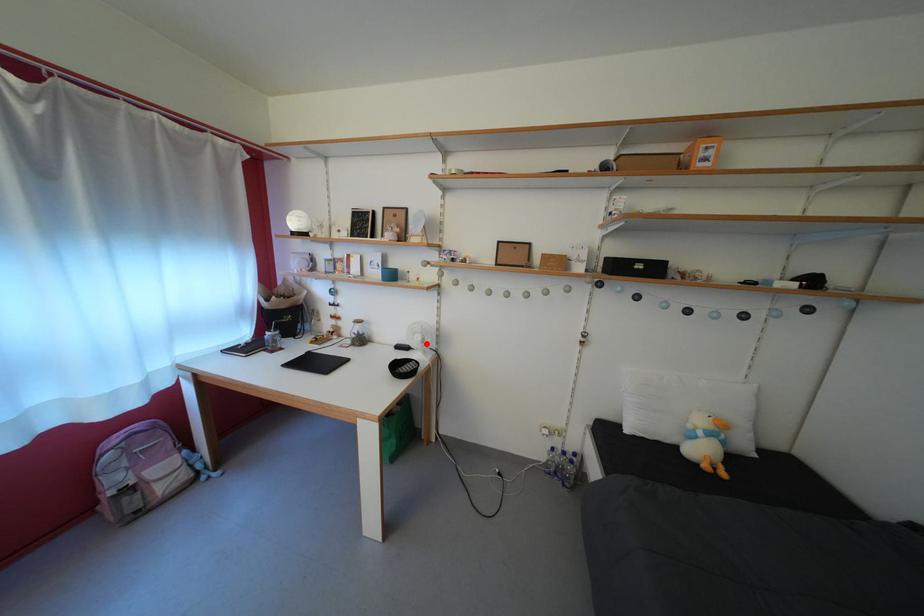
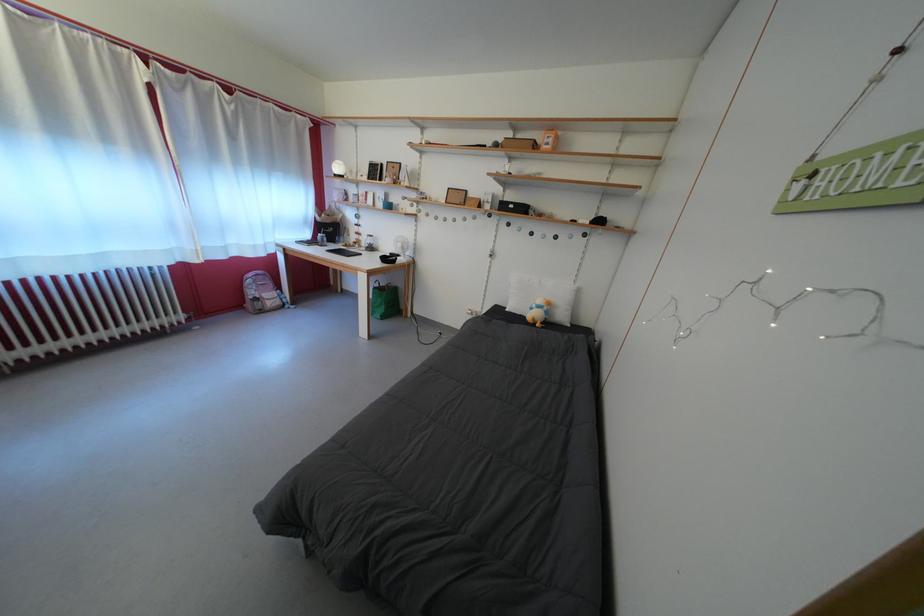
Find the pixel in the second image that matches the highlighted location in the first image.

(407, 251)